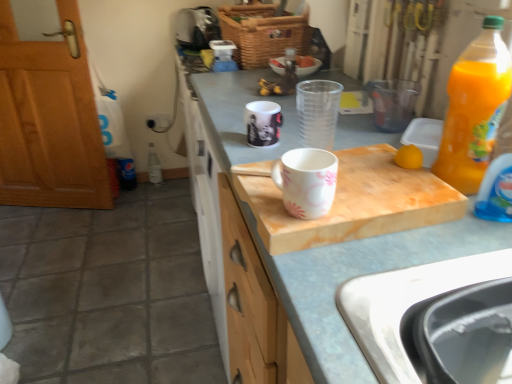
At what (x,y) coordinates should I click in order to perform the action: click on vacant area that is situated to the right of white glossy mug at center, which is the 2th coffee cup from bottom to top. Please return your answer as a coordinate pair (x, y). This screenshot has height=384, width=512. Looking at the image, I should click on (315, 129).